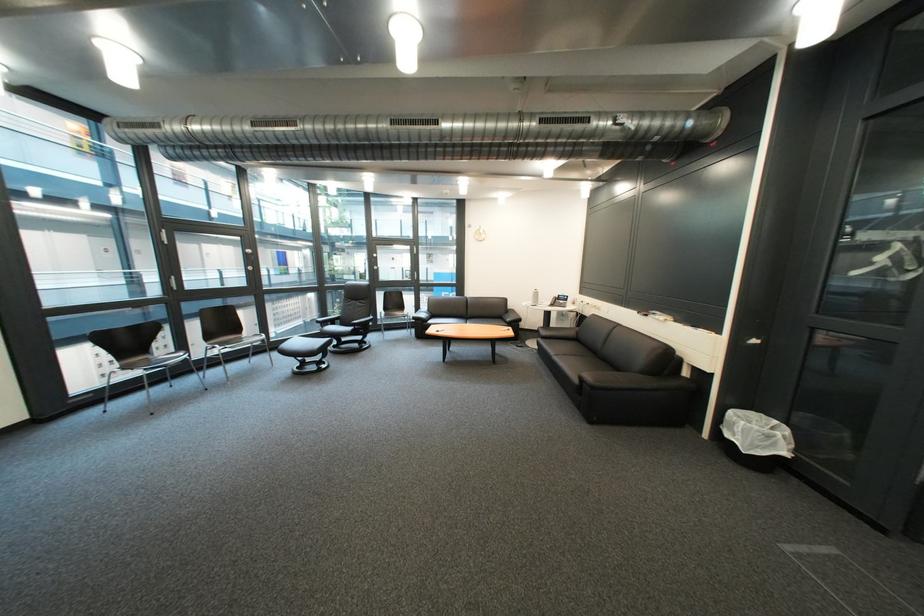
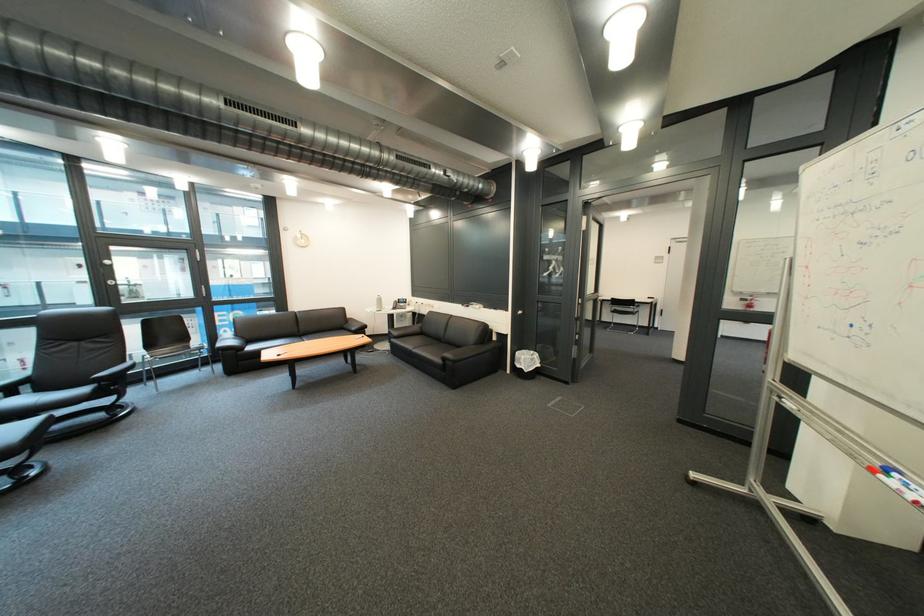
Where in the second image is the point corresponding to point (594, 381) from the first image?

(457, 361)